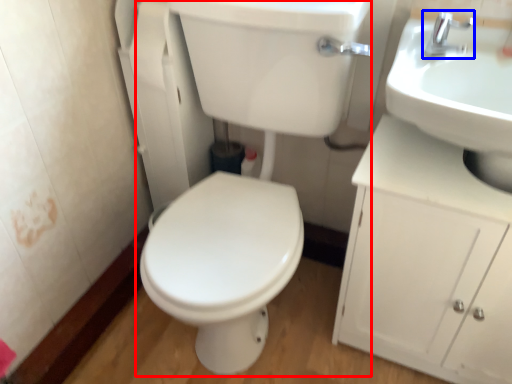
Question: Which of the following is the farthest to the observer, porcelain (highlighted by a red box) or tap (highlighted by a blue box)?

Choices:
 (A) porcelain
 (B) tap

Answer: (B)